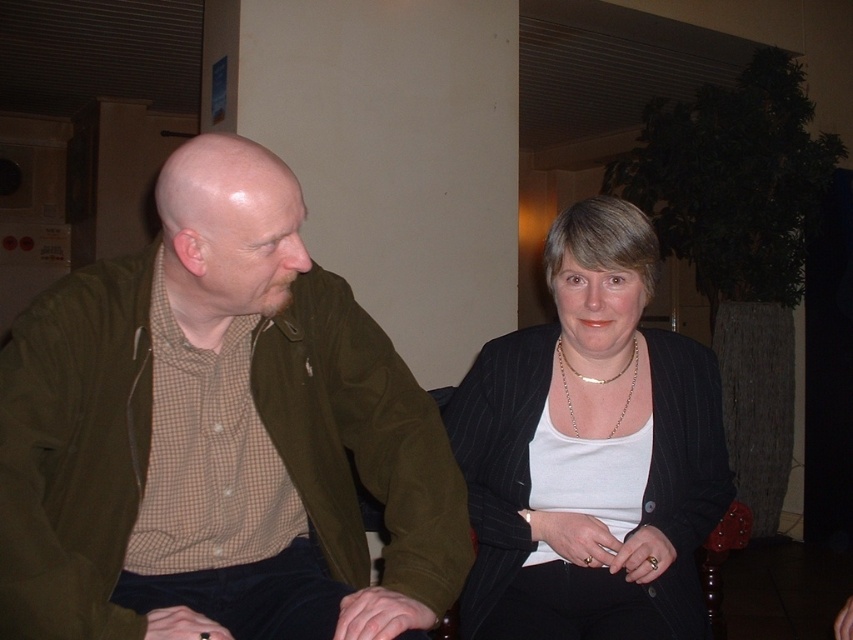
Between matte olive green jacket at left and white pinstripe blazer at center, which one has less height?

matte olive green jacket at left

Does matte olive green jacket at left have a greater height compared to white pinstripe blazer at center?

Incorrect, matte olive green jacket at left's height is not larger of white pinstripe blazer at center's.

Which is behind, point (357, 436) or point (579, 332)?

The point (579, 332) is behind.

Find the location of a particular element. matte olive green jacket at left is located at coordinates (218, 436).

Can you confirm if white pinstripe blazer at center is thinner than gold chain necklace at center?

No, white pinstripe blazer at center is not thinner than gold chain necklace at center.

Which is in front, point (521, 563) or point (566, 378)?

Point (521, 563) is in front.

Which is in front, point (634, 323) or point (569, 410)?

Positioned in front is point (634, 323).

You are a GUI agent. You are given a task and a screenshot of the screen. Output one action in this format:
    pyautogui.click(x=<x>, y=<y>)
    Task: Click on the white pinstripe blazer at center
    The width and height of the screenshot is (853, 640).
    Given the screenshot: What is the action you would take?
    pyautogui.click(x=590, y=451)

Who is shorter, matte olive green jacket at left or gold chain necklace at center?

gold chain necklace at center is shorter.

Between matte olive green jacket at left and gold chain necklace at center, which one appears on the right side from the viewer's perspective?

gold chain necklace at center

This screenshot has width=853, height=640. What do you see at coordinates (218, 436) in the screenshot?
I see `matte olive green jacket at left` at bounding box center [218, 436].

Identify the location of matte olive green jacket at left. The image size is (853, 640). (218, 436).